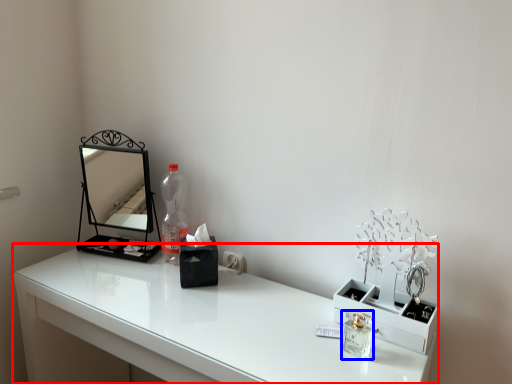
Question: Which object is closer to the camera taking this photo, table (highlighted by a red box) or perfume (highlighted by a blue box)?

Choices:
 (A) table
 (B) perfume

Answer: (A)